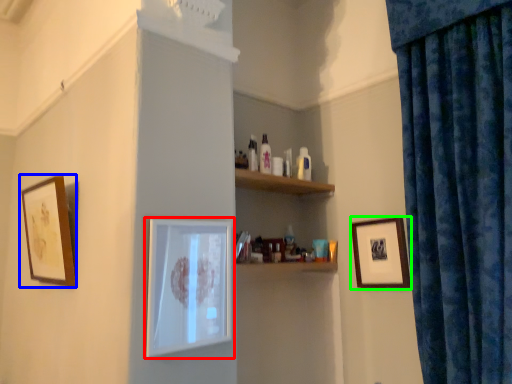
Question: Estimate the real-world distances between objects in this image. Which object is farther from picture frame (highlighted by a red box), picture frame (highlighted by a blue box) or picture frame (highlighted by a green box)?

Choices:
 (A) picture frame
 (B) picture frame

Answer: (B)